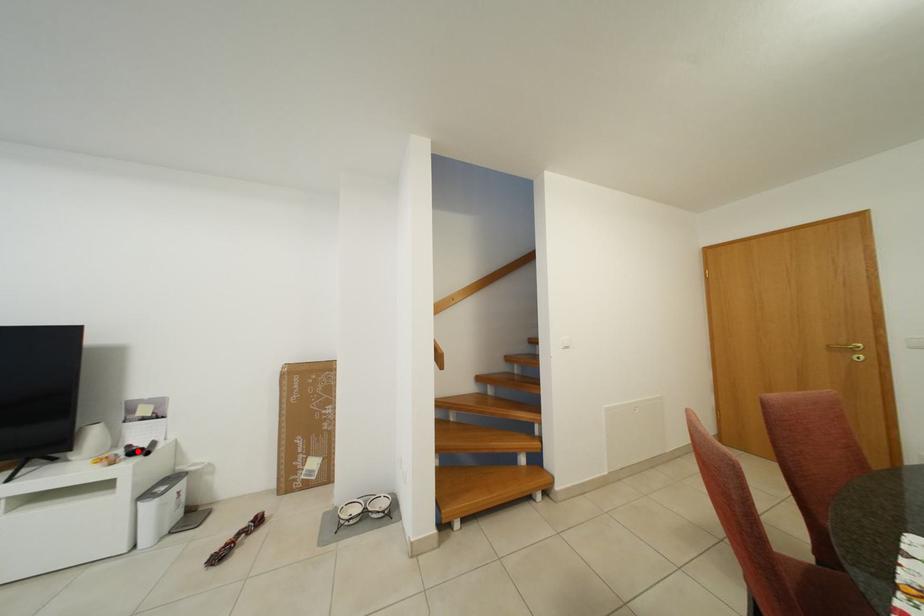
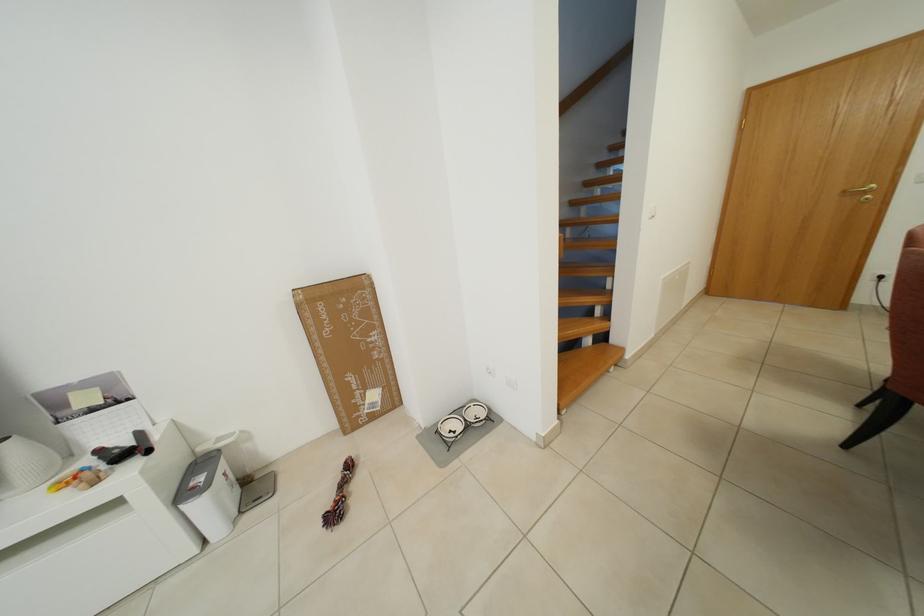
The point at the highlighted location is marked in the first image. Where is the corresponding point in the second image?

(108, 455)